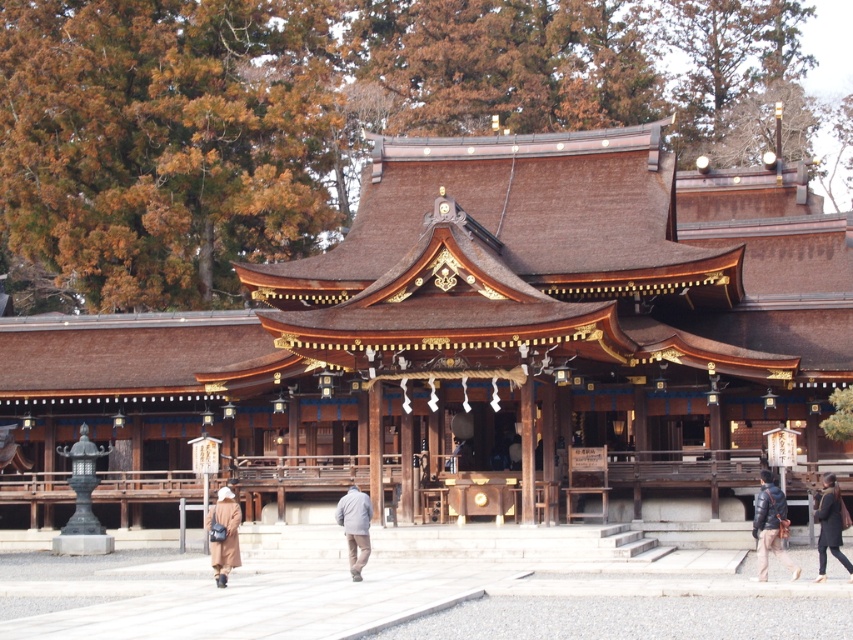
Is dark brown leather jacket at lower right thinner than gray woolen jacket at center?

Incorrect, dark brown leather jacket at lower right's width is not less than gray woolen jacket at center's.

Between point (762, 508) and point (357, 560), which one is positioned behind?

Positioned behind is point (762, 508).

Which is behind, point (762, 472) or point (351, 490)?

The point (762, 472) is more distant.

Image resolution: width=853 pixels, height=640 pixels. I want to click on dark brown leather jacket at lower right, so click(769, 525).

Is brown wool coat at lower left positioned behind black leather jacket at lower right?

Yes, brown wool coat at lower left is behind black leather jacket at lower right.

Is brown wool coat at lower left taller than black leather jacket at lower right?

Yes, brown wool coat at lower left is taller than black leather jacket at lower right.

Find the location of a particular element. brown wool coat at lower left is located at coordinates (224, 536).

Who is higher up, brown wool coat at lower left or gray woolen jacket at center?

gray woolen jacket at center is higher up.

Does brown wool coat at lower left have a larger size compared to gray woolen jacket at center?

Correct, brown wool coat at lower left is larger in size than gray woolen jacket at center.

Which is in front, point (218, 544) or point (341, 516)?

Positioned in front is point (218, 544).

Where is `brown wool coat at lower left`? brown wool coat at lower left is located at coordinates (224, 536).